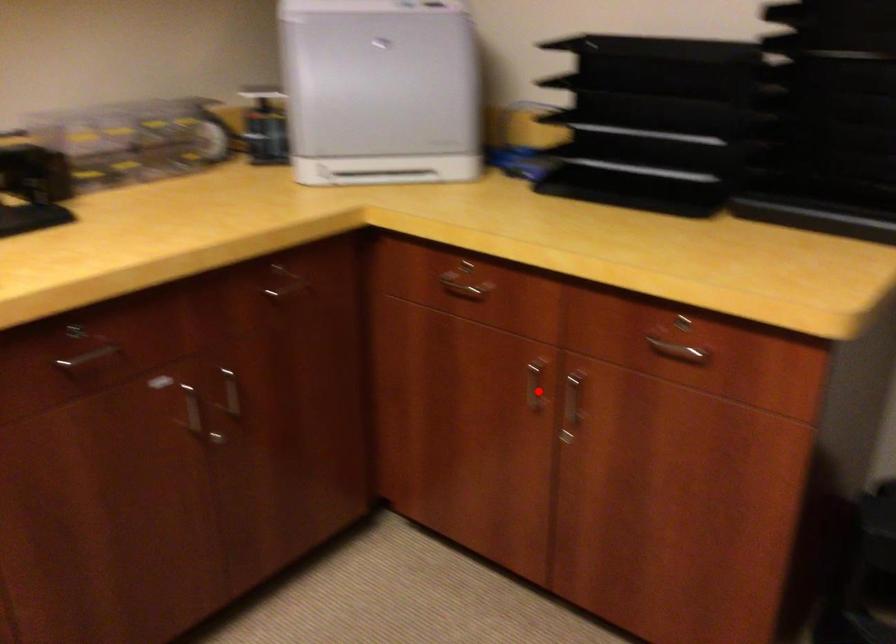
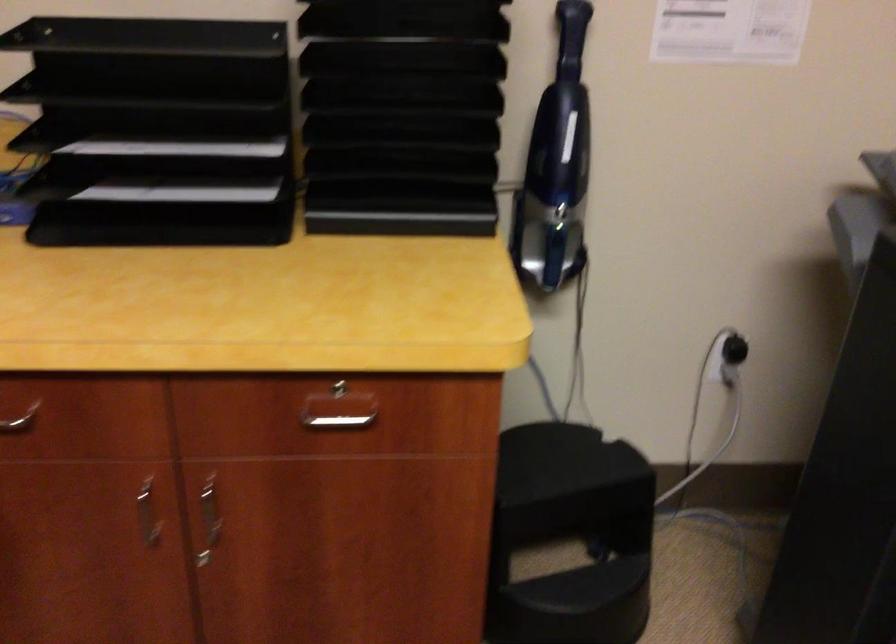
Question: I am providing you with two images of the same scene from different viewpoints. A red point is shown in image1. For the corresponding object point in image2, is it positioned nearer or farther from the camera?

Choices:
 (A) Nearer
 (B) Farther

Answer: (A)